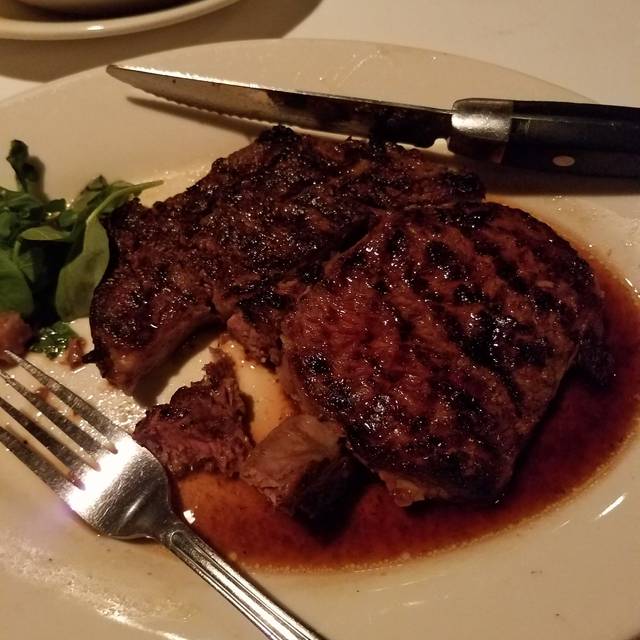
What are the coordinates of `handle` in the screenshot? It's located at (546, 136).